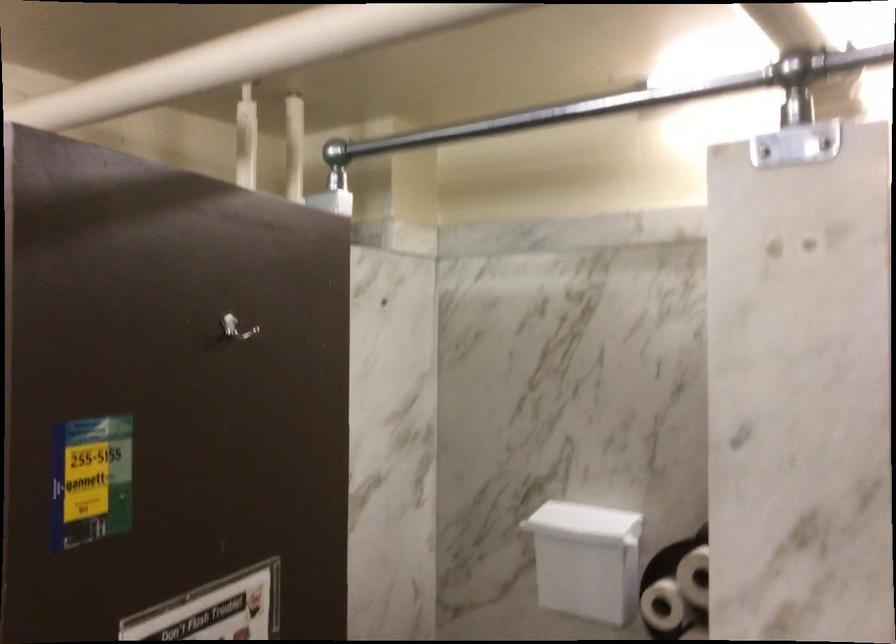
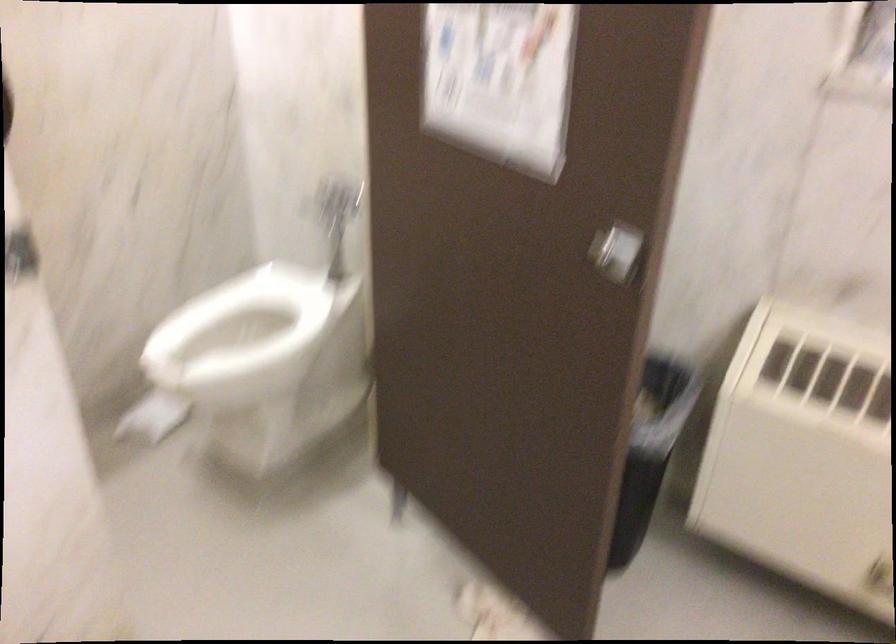
First-person continuous shooting, in which direction is the camera rotating?

The camera's rotation is toward right-down.